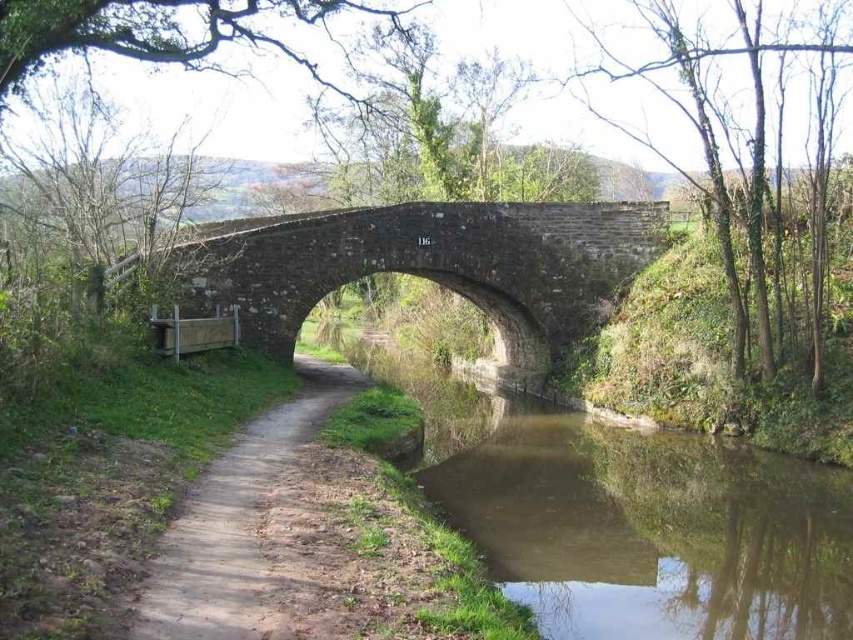
Question: Is brown smooth water at lower center positioned in front of brown stone bridge at center?

Choices:
 (A) no
 (B) yes

Answer: (B)

Question: Which of the following is the closest to the observer?

Choices:
 (A) (463, 522)
 (B) (492, 301)

Answer: (A)

Question: In this image, where is brown smooth water at lower center located relative to brown stone bridge at center?

Choices:
 (A) above
 (B) below

Answer: (B)

Question: Which object is closer to the camera taking this photo?

Choices:
 (A) brown stone bridge at center
 (B) dirt path at center
 (C) brown smooth water at lower center

Answer: (B)

Question: Does brown smooth water at lower center have a larger size compared to brown stone bridge at center?

Choices:
 (A) yes
 (B) no

Answer: (B)

Question: Which is farther from the dirt path at center?

Choices:
 (A) brown smooth water at lower center
 (B) brown stone bridge at center

Answer: (B)